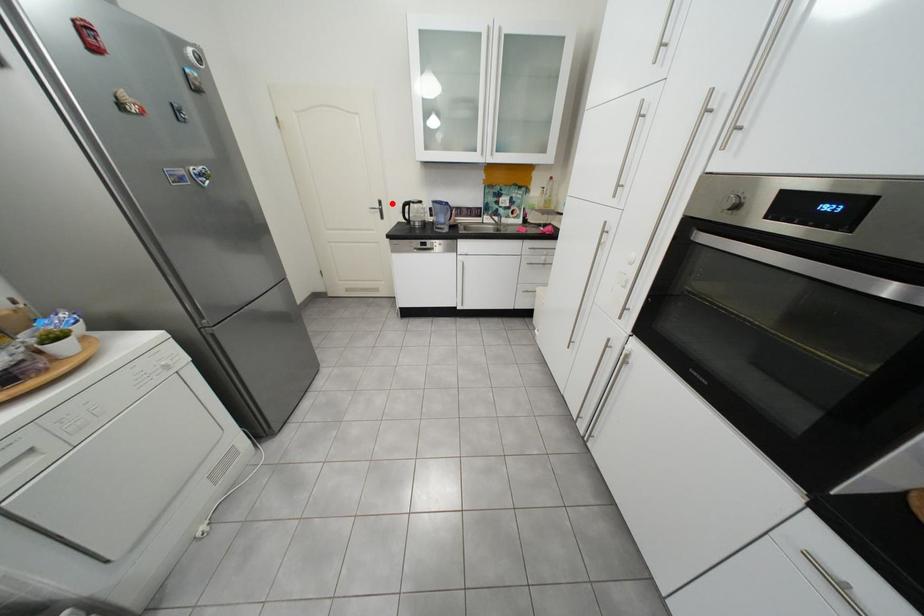
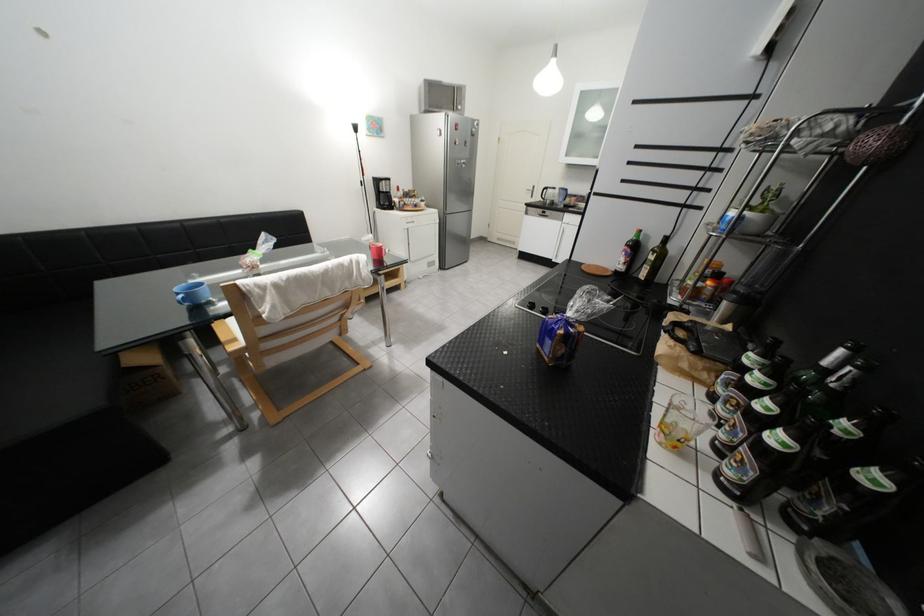
Question: I am providing you with two images of the same scene from different viewpoints. Image1 has a red point marked. In image2, the corresponding 3D location appears at what relative position? Reply with the corresponding letter.

Choices:
 (A) Closer
 (B) Farther

Answer: (A)